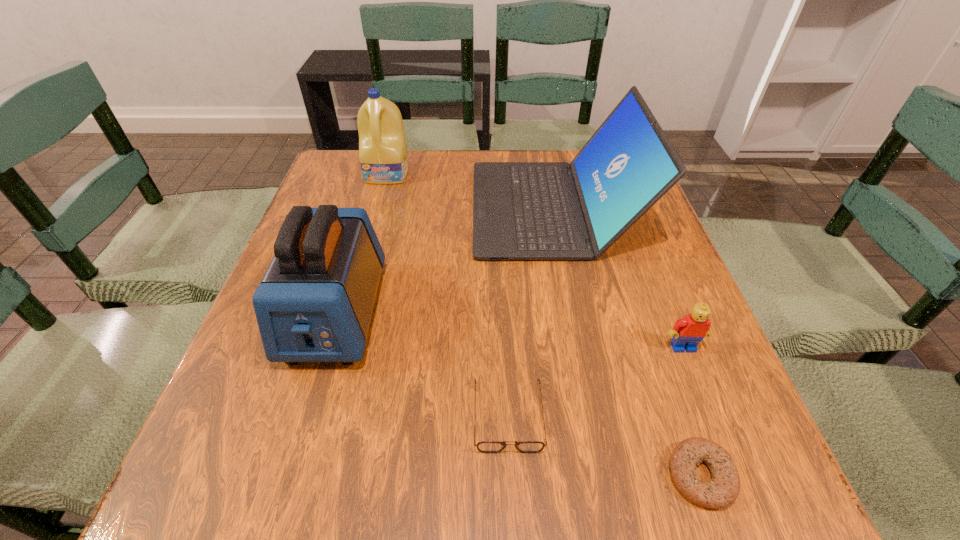
Find the location of a particular element. This screenshot has width=960, height=540. the third closest object to the detergent is located at coordinates (485, 446).

Locate an element on the screen. The width and height of the screenshot is (960, 540). free space that satisfies the following two spatial constraints: 1. on the front-facing side of the bagel; 2. on the right side of the toaster is located at coordinates (287, 476).

The width and height of the screenshot is (960, 540). Find the location of `free spot that satisfies the following two spatial constraints: 1. on the front-facing side of the toaster; 2. on the right side of the bagel`. free spot that satisfies the following two spatial constraints: 1. on the front-facing side of the toaster; 2. on the right side of the bagel is located at coordinates (287, 476).

Locate an element on the screen. free region that satisfies the following two spatial constraints: 1. on the screen of the laptop computer; 2. on the right side of the shortest object is located at coordinates (606, 476).

The width and height of the screenshot is (960, 540). I want to click on blank area in the image that satisfies the following two spatial constraints: 1. on the screen of the laptop computer; 2. on the front-facing side of the toaster, so click(574, 313).

Image resolution: width=960 pixels, height=540 pixels. In order to click on vacant space that satisfies the following two spatial constraints: 1. on the screen of the laptop computer; 2. on the front-facing side of the sunglasses in this screenshot , I will do [x=594, y=416].

This screenshot has width=960, height=540. Find the location of `free space that satisfies the following two spatial constraints: 1. on the screen of the laptop computer; 2. on the front-facing side of the toaster`. free space that satisfies the following two spatial constraints: 1. on the screen of the laptop computer; 2. on the front-facing side of the toaster is located at coordinates (574, 313).

I want to click on vacant area in the image that satisfies the following two spatial constraints: 1. on the label of the shortest object; 2. on the right side of the detergent, so click(306, 476).

Locate an element on the screen. This screenshot has width=960, height=540. vacant space that satisfies the following two spatial constraints: 1. on the front-facing side of the bagel; 2. on the right side of the toaster is located at coordinates (287, 476).

At what (x,y) coordinates should I click in order to perform the action: click on free location that satisfies the following two spatial constraints: 1. on the front-facing side of the toaster; 2. on the right side of the shortest object. Please return your answer as a coordinate pair (x, y). Looking at the image, I should click on (287, 476).